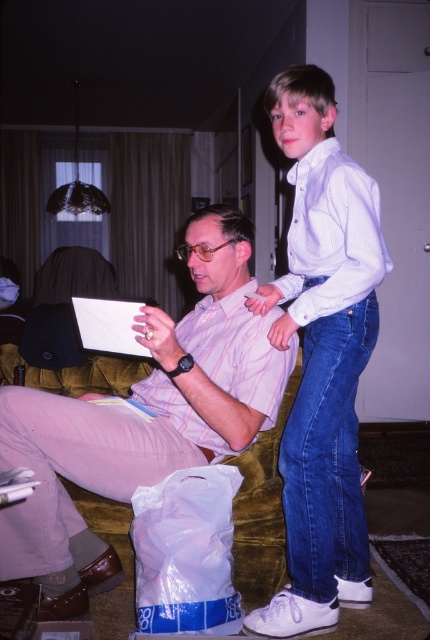
Question: Which point appears farthest from the camera in this image?

Choices:
 (A) (218, 330)
 (B) (344, 454)

Answer: (B)

Question: Which point is closer to the camera?

Choices:
 (A) (193, 408)
 (B) (20, 541)
 (C) (298, 84)

Answer: (B)

Question: Which point is farther from the camera taking this photo?

Choices:
 (A) (230, 312)
 (B) (346, 513)
 (C) (83, 484)

Answer: (B)

Question: Is white denim jeans at upper right closer to the viewer compared to pink striped shirt at center?

Choices:
 (A) no
 (B) yes

Answer: (B)

Question: Can you confirm if white denim jeans at upper right is positioned to the left of pink striped shirt at center?

Choices:
 (A) yes
 (B) no

Answer: (B)

Question: Is pink fabric shirt at center bigger than white denim jeans at upper right?

Choices:
 (A) yes
 (B) no

Answer: (A)